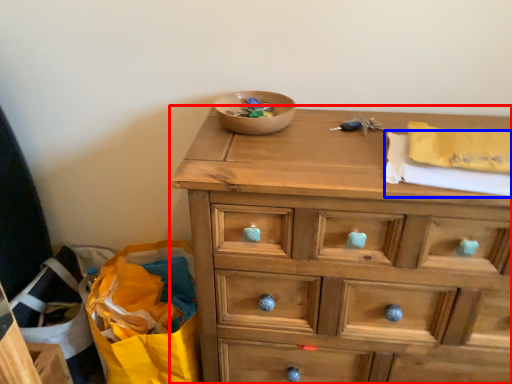
Question: Which object appears closest to the camera in this image, chest of drawers (highlighted by a red box) or clothe (highlighted by a blue box)?

Choices:
 (A) chest of drawers
 (B) clothe

Answer: (A)